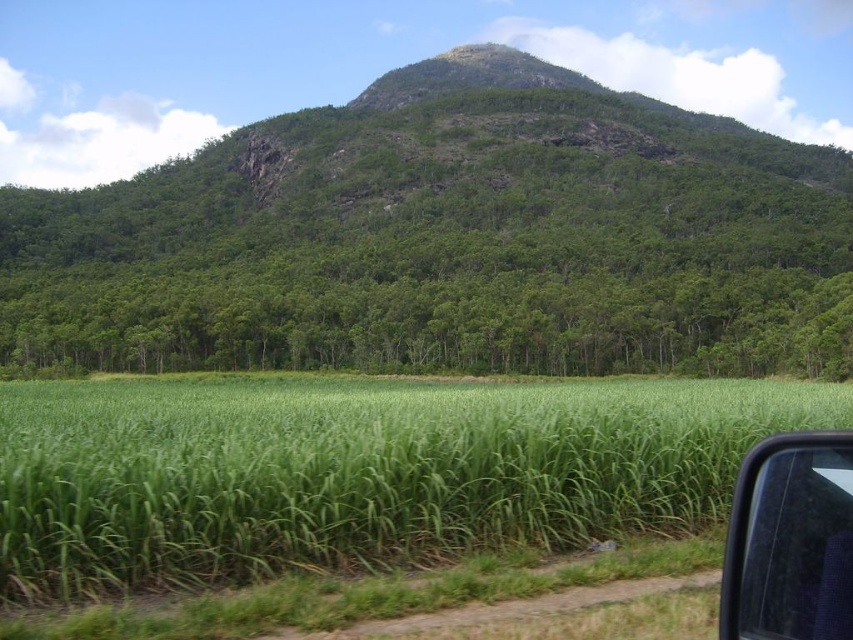
You are sitting in a car and looking out the transparent glass car window at lower right. Can you see the green leafy forest at upper center through the window?

The transparent glass car window at lower right is behind green leafy forest at upper center, so you cannot see the green leafy forest at upper center through the window because the forest is in front of the window.

You are standing at the point with coordinates point (518, 305) and want to walk to point (222, 541). Given the terrain described in the scene, will you have an unobstructed path? Please explain your reasoning.

The point (518, 305) is behind point (222, 541). Since the terrain includes a dirt path through the field and the forest is in the midground, you might have an unobstructed path along the dirt path towards point (222, 541). However, the forest could block the direct line between them, so you need to follow the path.